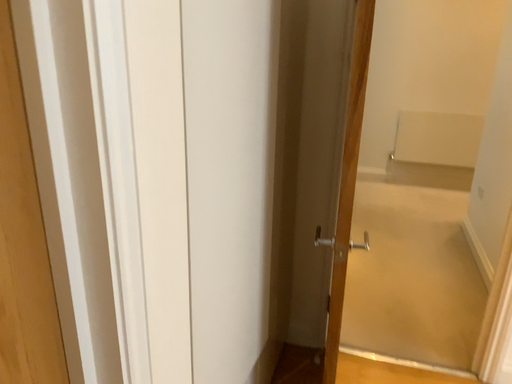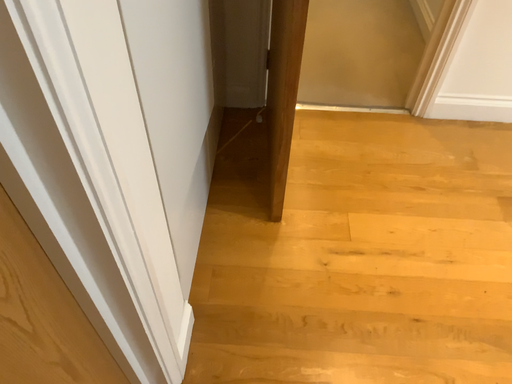
Question: Which way did the camera rotate in the video?

Choices:
 (A) rotated right
 (B) rotated left

Answer: (A)